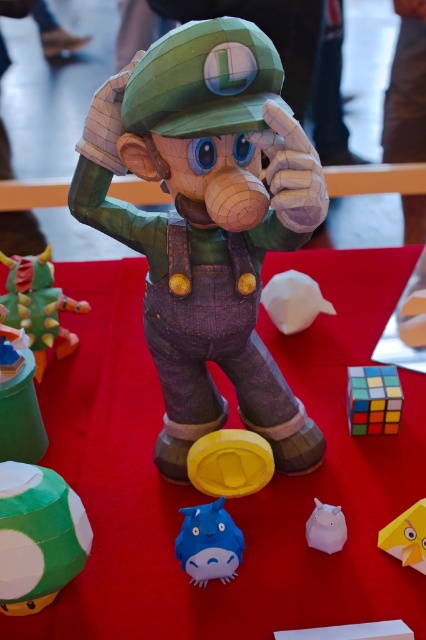
Question: Can you confirm if matte brown paper luigi at center is thinner than green matte dragon at left?

Choices:
 (A) no
 (B) yes

Answer: (A)

Question: Is red fabric table at center below yellow paper toy at center?

Choices:
 (A) no
 (B) yes

Answer: (A)

Question: Among these objects, which one is farthest from the camera?

Choices:
 (A) yellow matte coin at center
 (B) yellow paper toy at center
 (C) blue matte plush toy at center
 (D) red fabric table at center

Answer: (A)

Question: Which object appears closest to the camera in this image?

Choices:
 (A) matte brown paper luigi at center
 (B) matte white plush at center
 (C) green paper mushroom at lower left
 (D) yellow paper toy at center

Answer: (A)

Question: Estimate the real-world distances between objects in this image. Which object is farther from the green matte dragon at left?

Choices:
 (A) yellow matte coin at center
 (B) blue matte plush toy at center

Answer: (B)

Question: Can you confirm if matte brown paper luigi at center is positioned below white matte paper hat at center?

Choices:
 (A) no
 (B) yes

Answer: (A)